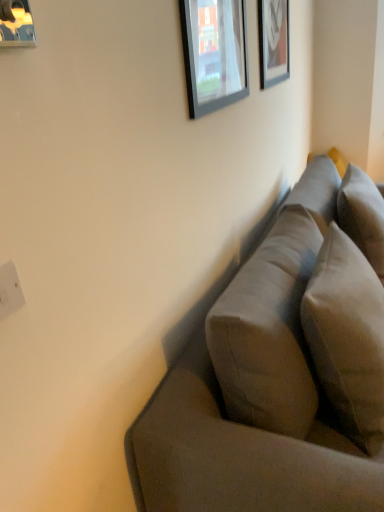
Question: From the image's perspective, would you say white plastic electric outlet at lower left is positioned over matte glass picture frame at upper center, which is the 2th picture frame from back to front?

Choices:
 (A) no
 (B) yes

Answer: (A)

Question: Is white plastic electric outlet at lower left to the left of matte glass picture frame at upper center, which ranks as the second picture frame in left-to-right order, from the viewer's perspective?

Choices:
 (A) no
 (B) yes

Answer: (B)

Question: From a real-world perspective, is white plastic electric outlet at lower left on matte glass picture frame at upper center, the 2th picture frame from the front?

Choices:
 (A) yes
 (B) no

Answer: (B)

Question: Is white plastic electric outlet at lower left positioned with its back to matte glass picture frame at upper center, which ranks as the second picture frame in left-to-right order?

Choices:
 (A) yes
 (B) no

Answer: (B)

Question: Is white plastic electric outlet at lower left at the right side of matte glass picture frame at upper center, which is the 2th picture frame from back to front?

Choices:
 (A) no
 (B) yes

Answer: (A)

Question: In terms of height, does metallic silver picture frame at upper left, acting as the 1th picture frame starting from the left, look taller or shorter compared to suede-like beige pillow at right?

Choices:
 (A) short
 (B) tall

Answer: (A)

Question: From a real-world perspective, relative to suede-like beige pillow at right, is metallic silver picture frame at upper left, positioned as the first picture frame in front-to-back order, vertically above or below?

Choices:
 (A) below
 (B) above

Answer: (B)

Question: Do you think metallic silver picture frame at upper left, positioned as the first picture frame in front-to-back order, is within suede-like beige pillow at right, or outside of it?

Choices:
 (A) inside
 (B) outside

Answer: (B)

Question: Is metallic silver picture frame at upper left, which is counted as the third picture frame, starting from the right, in front of or behind suede-like beige pillow at right in the image?

Choices:
 (A) front
 (B) behind

Answer: (A)

Question: Visually, is wooden frame at upper right, acting as the first picture frame starting from the back, positioned to the left or to the right of suede-like gray couch at right?

Choices:
 (A) left
 (B) right

Answer: (A)

Question: Is wooden frame at upper right, acting as the first picture frame starting from the back, situated inside suede-like gray couch at right or outside?

Choices:
 (A) outside
 (B) inside

Answer: (A)

Question: From a real-world perspective, is wooden frame at upper right, marked as the 3th picture frame in a left-to-right arrangement, above or below suede-like gray couch at right?

Choices:
 (A) below
 (B) above

Answer: (B)

Question: In the image, is wooden frame at upper right, positioned as the third picture frame in front-to-back order, positioned in front of or behind suede-like gray couch at right?

Choices:
 (A) behind
 (B) front

Answer: (A)

Question: Would you say wooden frame at upper right, acting as the first picture frame starting from the back, is inside or outside white plastic electric outlet at lower left?

Choices:
 (A) inside
 (B) outside

Answer: (B)

Question: From the image's perspective, is wooden frame at upper right, positioned as the 1th picture frame in right-to-left order, above or below white plastic electric outlet at lower left?

Choices:
 (A) below
 (B) above

Answer: (B)